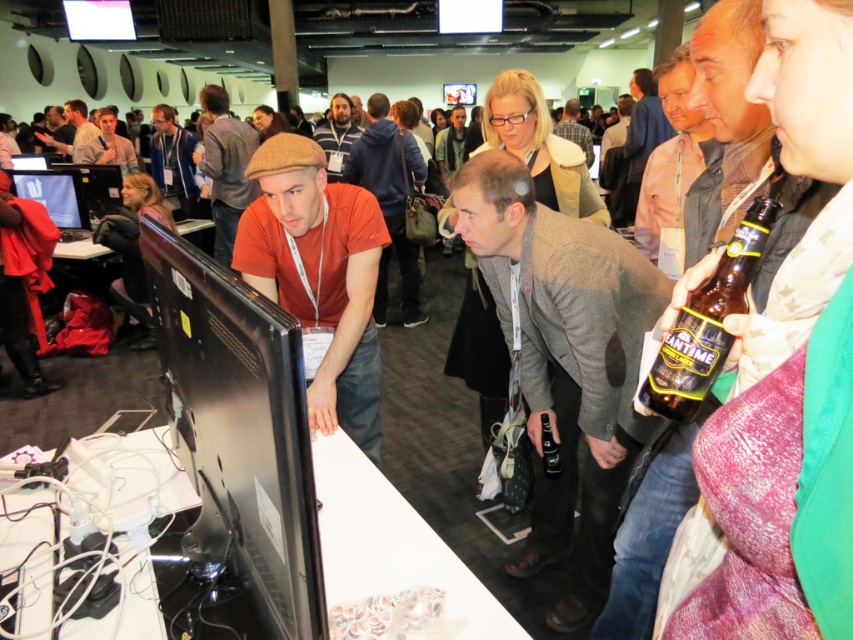
Which is behind, point (706, 392) or point (451, 124)?

The point (451, 124) is behind.

Which is below, dark amber glass bottle at upper right or light brown leather jacket at center?

dark amber glass bottle at upper right

Describe the element at coordinates (706, 323) in the screenshot. This screenshot has width=853, height=640. I see `dark amber glass bottle at upper right` at that location.

This screenshot has width=853, height=640. What are the coordinates of `dark amber glass bottle at upper right` in the screenshot? It's located at (706, 323).

Does black glossy monitor at center come in front of matte brown cap at upper center?

Yes, it is in front of matte brown cap at upper center.

Who is more forward, (212,264) or (100,154)?

Point (212,264) is in front.

Who is more forward, (260, 570) or (119, 144)?

Point (260, 570)

You are a GUI agent. You are given a task and a screenshot of the screen. Output one action in this format:
    pyautogui.click(x=<x>, y=<y>)
    Task: Click on the black glossy monitor at center
    
    Given the screenshot: What is the action you would take?
    point(234,452)

Does black glossy monitor at center have a larger size compared to translucent plastic bottle at center?

Correct, black glossy monitor at center is larger in size than translucent plastic bottle at center.

Where is `black glossy monitor at center`? This screenshot has height=640, width=853. black glossy monitor at center is located at coordinates point(234,452).

At what (x,y) coordinates should I click in order to perform the action: click on black glossy monitor at center. Please return your answer as a coordinate pair (x, y). This screenshot has width=853, height=640. Looking at the image, I should click on (234, 452).